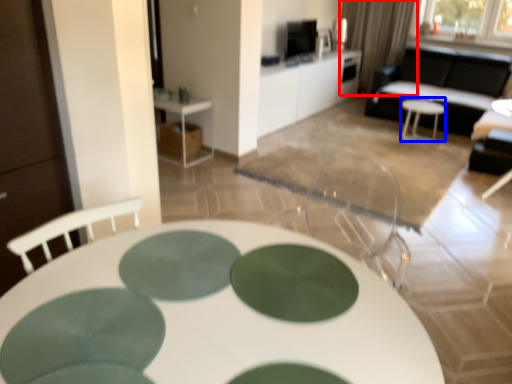
Question: Which object is closer to the camera taking this photo, curtain (highlighted by a red box) or side table (highlighted by a blue box)?

Choices:
 (A) curtain
 (B) side table

Answer: (B)